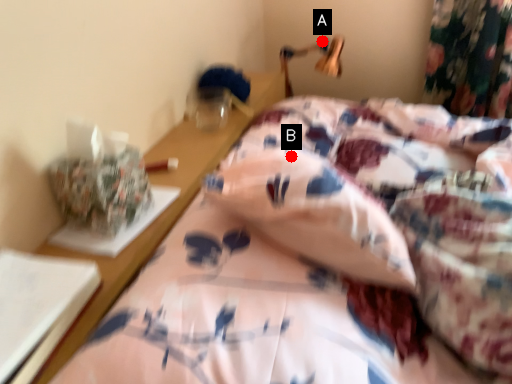
Question: Two points are circled on the image, labeled by A and B beside each circle. Among these points, which one is nearest to the camera?

Choices:
 (A) A is closer
 (B) B is closer

Answer: (B)